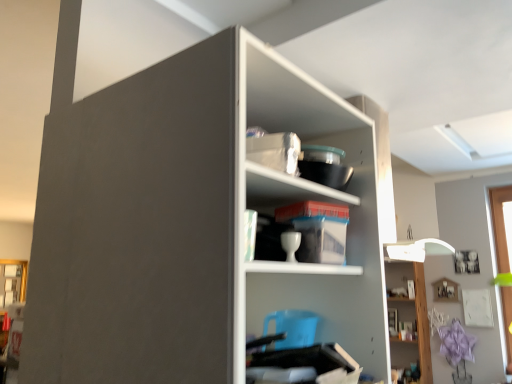
Question: From the image's perspective, relative to white glossy cup at center, which ranks as the second shelf in back-to-front order, is white glossy cabinet at upper right above or below?

Choices:
 (A) below
 (B) above

Answer: (A)

Question: Is white glossy cabinet at upper right wider or thinner than white glossy cup at center, which is counted as the 2th shelf, starting from the right?

Choices:
 (A) wide
 (B) thin

Answer: (B)

Question: Considering the real-world distances, which object is farthest from the white matte shelf at center, which is counted as the 3th shelf, starting from the back?

Choices:
 (A) white glossy lamp at upper right, marked as the third shelf in a top-to-bottom arrangement
 (B) white glossy cabinet at upper right
 (C) matte gold frame at lower left
 (D) white glossy cup at center, which is counted as the 2th shelf, starting from the left

Answer: (A)

Question: Considering the real-world distances, which object is closest to the white glossy cabinet at upper right?

Choices:
 (A) white glossy cup at center, which is counted as the 2th shelf, starting from the right
 (B) white matte shelf at center, positioned as the 1th shelf in front-to-back order
 (C) white glossy lamp at upper right, arranged as the 3th shelf when viewed from the front
 (D) matte gold frame at lower left

Answer: (C)